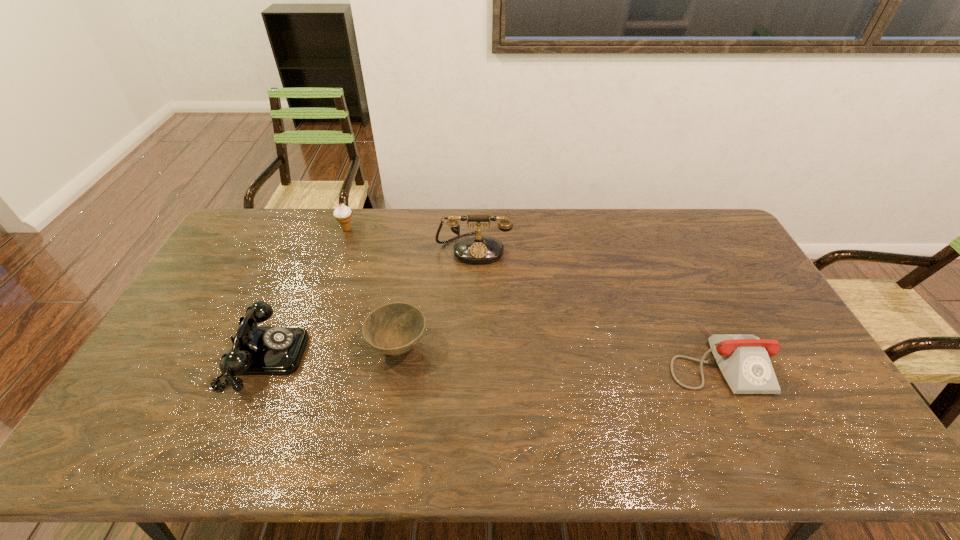
Where is `vacant space situated 0.100m on the left of the bowl`? This screenshot has height=540, width=960. vacant space situated 0.100m on the left of the bowl is located at coordinates (334, 347).

The height and width of the screenshot is (540, 960). Find the location of `vacant space located 0.110m on the dial of the rightmost telephone`. vacant space located 0.110m on the dial of the rightmost telephone is located at coordinates (752, 437).

Image resolution: width=960 pixels, height=540 pixels. Find the location of `telephone that is at the far edge`. telephone that is at the far edge is located at coordinates (478, 249).

You are a GUI agent. You are given a task and a screenshot of the screen. Output one action in this format:
    pyautogui.click(x=<x>, y=<y>)
    Task: Click on the icecream that is at the far edge
    
    Given the screenshot: What is the action you would take?
    pyautogui.click(x=343, y=214)

In order to click on object that is at the right edge in this screenshot , I will do (743, 359).

Find the location of `free location at the far edge`. free location at the far edge is located at coordinates (306, 211).

Locate an element on the screen. This screenshot has height=540, width=960. free space at the near edge of the desktop is located at coordinates (318, 428).

The height and width of the screenshot is (540, 960). Identify the location of free space at the left edge of the desktop. (258, 256).

Find the location of a particular element. vacant space at the near right corner of the desktop is located at coordinates (860, 458).

This screenshot has height=540, width=960. In order to click on vacant space in between the shortest telephone and the bowl in this screenshot , I will do `click(557, 353)`.